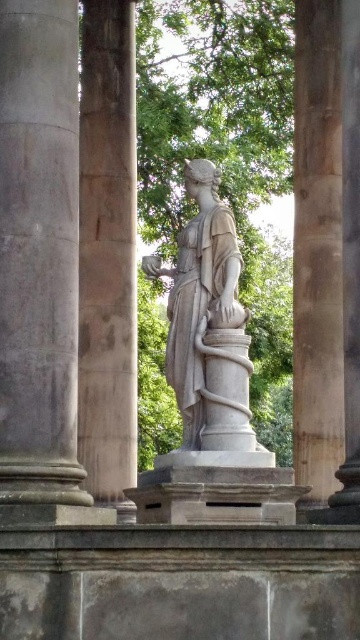
Question: From the image, what is the correct spatial relationship of gray stone column at left in relation to smooth stone column at right?

Choices:
 (A) above
 (B) below

Answer: (B)

Question: Which object is positioned closest to the gray stone column at left?

Choices:
 (A) smooth stone column at right
 (B) smooth stone column at center
 (C) green leafy tree at center
 (D) white marble statue at center

Answer: (D)

Question: Is gray stone column at left in front of smooth stone column at right?

Choices:
 (A) no
 (B) yes

Answer: (B)

Question: Can you confirm if smooth stone column at center is bigger than white marble statue at center?

Choices:
 (A) no
 (B) yes

Answer: (B)

Question: Which of the following is the farthest from the observer?

Choices:
 (A) (295, 323)
 (B) (23, 240)
 (C) (159, 243)
 (D) (118, 260)

Answer: (C)

Question: Which of the following is the closest to the observer?

Choices:
 (A) (x=335, y=28)
 (B) (x=122, y=100)
 (C) (x=69, y=468)
 (D) (x=249, y=278)

Answer: (C)